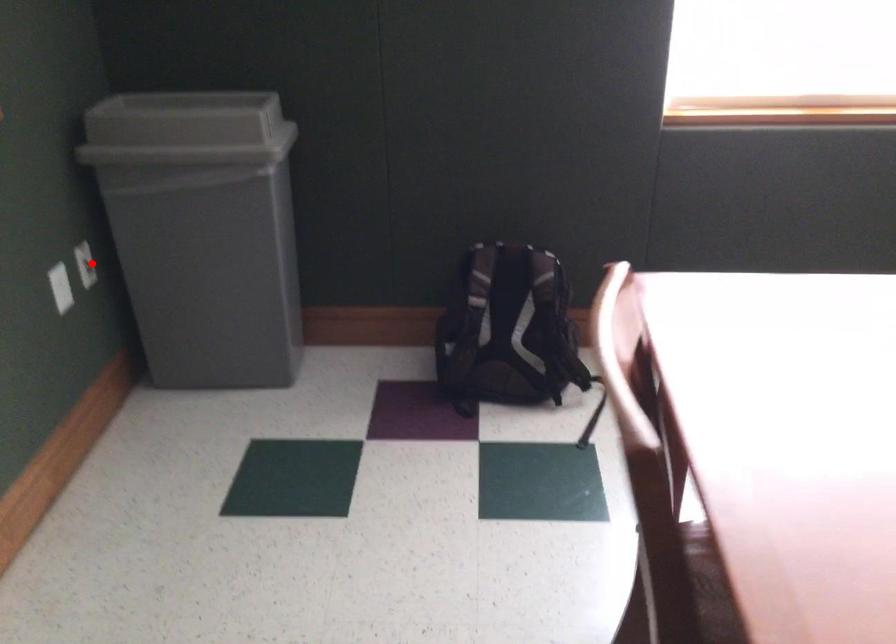
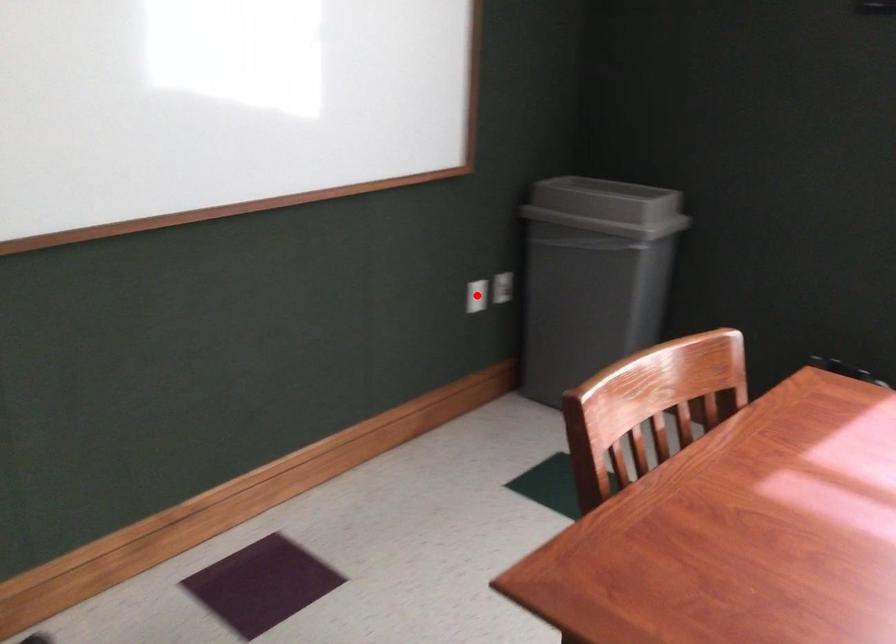
I am providing you with two images of the same scene from different viewpoints. A red point is marked on the first image and another point is marked on the second image. Is the marked point in image1 the same physical position as the marked point in image2?

No